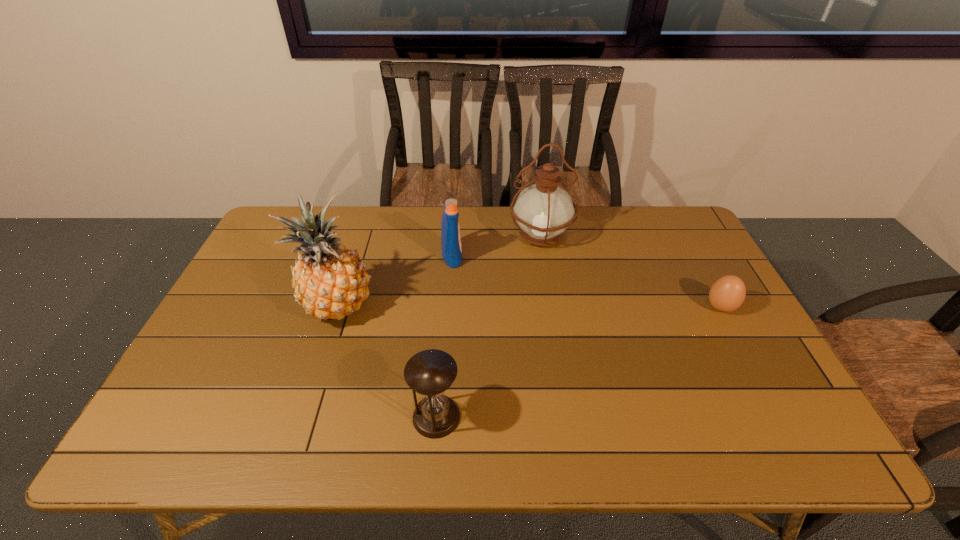
Image resolution: width=960 pixels, height=540 pixels. Find the location of `free space located on the right of the hourglass`. free space located on the right of the hourglass is located at coordinates (561, 416).

Image resolution: width=960 pixels, height=540 pixels. Identify the location of vacant space positioned 0.070m on the left of the rightmost object. pos(681,307).

Find the location of a particular element. oil lamp that is at the far edge is located at coordinates (543, 211).

You are a GUI agent. You are given a task and a screenshot of the screen. Output one action in this format:
    pyautogui.click(x=<x>, y=<y>)
    Task: Click on the detergent that is at the far edge
    
    Given the screenshot: What is the action you would take?
    pyautogui.click(x=451, y=248)

Image resolution: width=960 pixels, height=540 pixels. In order to click on object that is at the near edge in this screenshot , I will do `click(431, 372)`.

Image resolution: width=960 pixels, height=540 pixels. What are the coordinates of `object located at the right edge` in the screenshot? It's located at pyautogui.click(x=728, y=293).

The height and width of the screenshot is (540, 960). Identify the location of blank space at the far edge of the desktop. (476, 211).

This screenshot has width=960, height=540. In order to click on free space at the near edge in this screenshot , I will do `click(628, 434)`.

You are a GUI agent. You are given a task and a screenshot of the screen. Output one action in this format:
    pyautogui.click(x=<x>, y=<y>)
    Task: Click on the vacant space at the left edge of the desktop
    
    Given the screenshot: What is the action you would take?
    pyautogui.click(x=221, y=404)

This screenshot has width=960, height=540. Identify the location of vacant space at the right edge of the desktop. (722, 311).